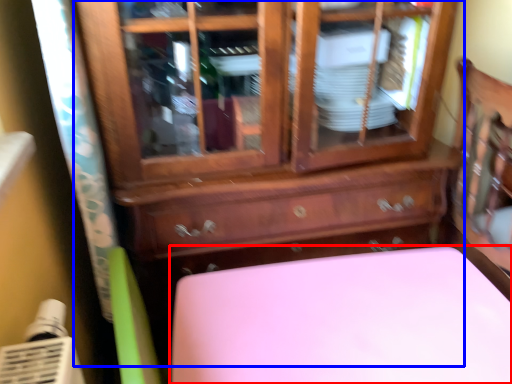
Question: Which point is closer to the camera, furniture (highlighted by a red box) or chest of drawers (highlighted by a blue box)?

Choices:
 (A) furniture
 (B) chest of drawers

Answer: (B)